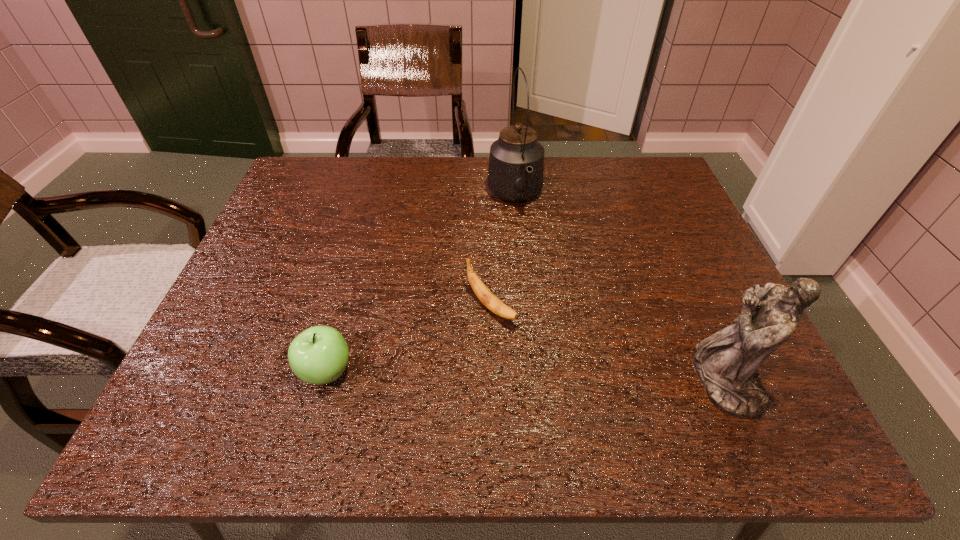
This screenshot has height=540, width=960. What are the coordinates of `vacant region that satisfies the following two spatial constraints: 1. on the back side of the second farthest object; 2. on the left side of the apple` in the screenshot? It's located at [345, 306].

The image size is (960, 540). I want to click on vacant point that satisfies the following two spatial constraints: 1. on the front side of the farthest object; 2. on the front-facing side of the rightmost object, so click(533, 380).